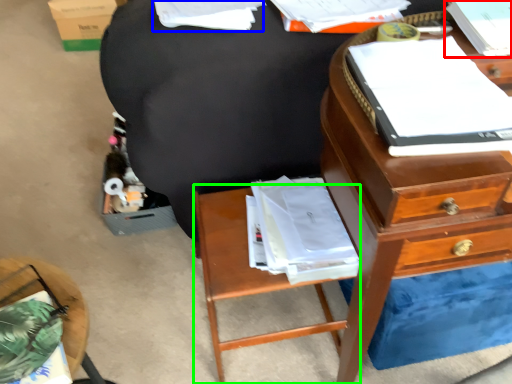
Question: Which object is positioned closest to book (highlighted by a red box)? Select from book (highlighted by a blue box) and nightstand (highlighted by a green box).

Choices:
 (A) book
 (B) nightstand

Answer: (A)